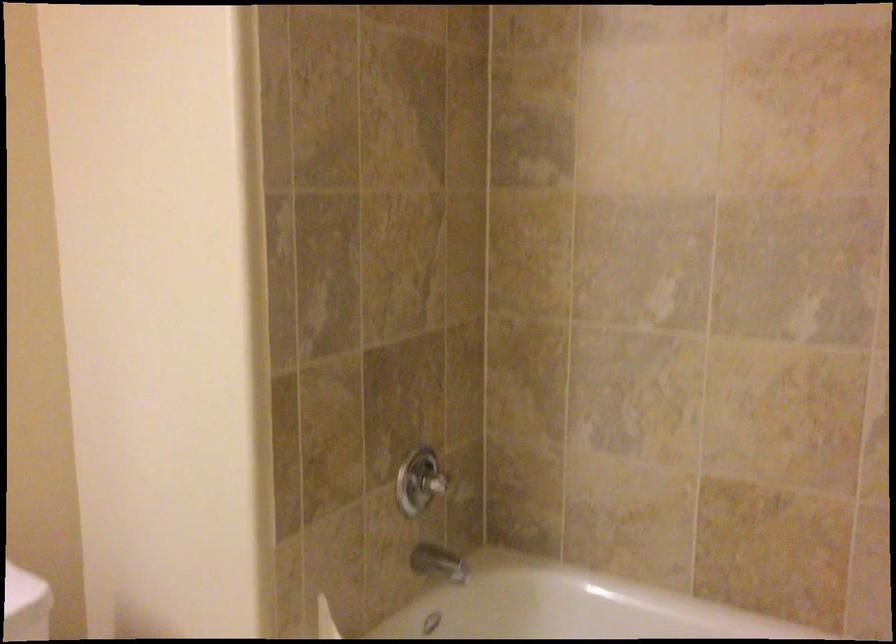
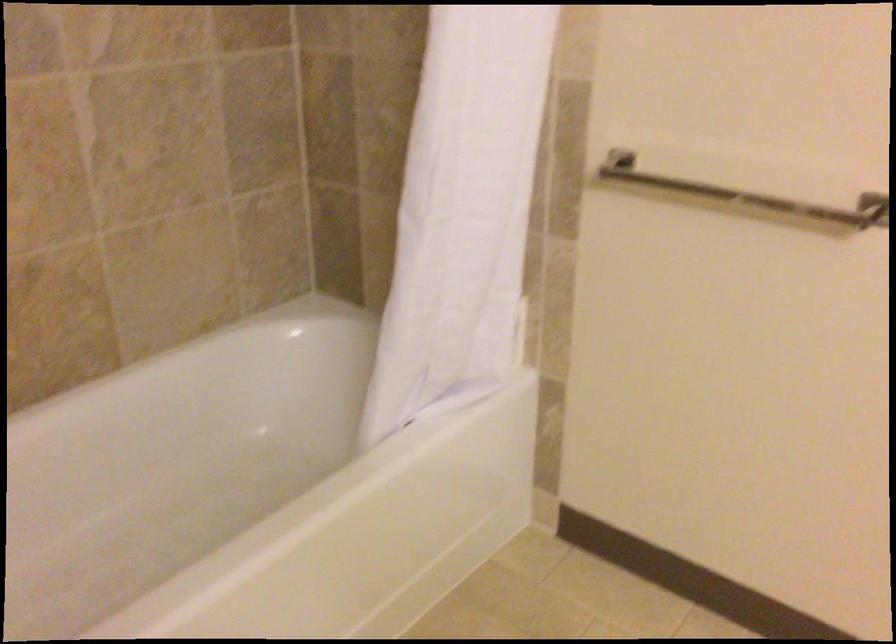
How did the camera likely rotate?

The camera rotated toward right-down.